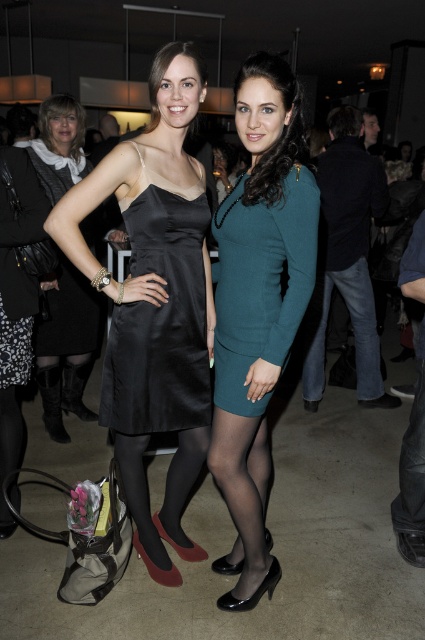
Can you confirm if teal woolen dress at center is positioned below jeans at center?

Actually, teal woolen dress at center is above jeans at center.

This screenshot has height=640, width=425. In order to click on teal woolen dress at center in this screenshot , I will do `click(260, 282)`.

Where is `teal woolen dress at center`? teal woolen dress at center is located at coordinates (260, 282).

Is point (164, 164) closer to camera compared to point (257, 272)?

No, it is behind (257, 272).

Can you confirm if satin dress at left is positioned to the left of teal woolen dress at center?

Correct, you'll find satin dress at left to the left of teal woolen dress at center.

What do you see at coordinates (155, 301) in the screenshot? I see `satin dress at left` at bounding box center [155, 301].

What are the coordinates of `satin dress at left` in the screenshot? It's located at (155, 301).

Can you confirm if satin dress at left is bigger than matte black dress at left?

No, satin dress at left is not bigger than matte black dress at left.

This screenshot has height=640, width=425. I want to click on satin dress at left, so click(155, 301).

Locate an element on the screen. satin dress at left is located at coordinates (155, 301).